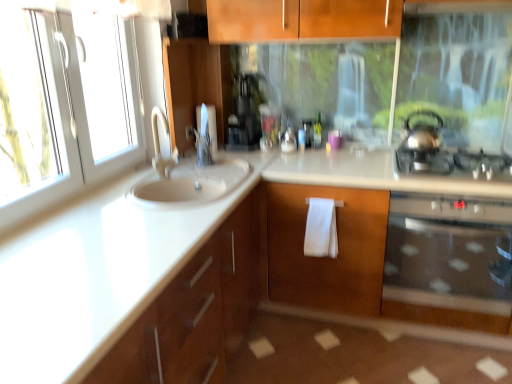
Question: Can you confirm if white cotton bath towel at center is wider than white glossy toilet paper at upper center?

Choices:
 (A) no
 (B) yes

Answer: (A)

Question: Is white cotton bath towel at center at the left side of white glossy toilet paper at upper center?

Choices:
 (A) yes
 (B) no

Answer: (B)

Question: Is white cotton bath towel at center to the right of white glossy toilet paper at upper center from the viewer's perspective?

Choices:
 (A) no
 (B) yes

Answer: (B)

Question: From a real-world perspective, is white cotton bath towel at center on top of white glossy toilet paper at upper center?

Choices:
 (A) yes
 (B) no

Answer: (B)

Question: Is white cotton bath towel at center positioned in front of white glossy toilet paper at upper center?

Choices:
 (A) yes
 (B) no

Answer: (A)

Question: Would you say white cotton bath towel at center is to the left or to the right of satin silver gas stove at right in the picture?

Choices:
 (A) right
 (B) left

Answer: (B)

Question: Is white cotton bath towel at center wider or thinner than satin silver gas stove at right?

Choices:
 (A) thin
 (B) wide

Answer: (A)

Question: Considering their positions, is white cotton bath towel at center located in front of or behind satin silver gas stove at right?

Choices:
 (A) behind
 (B) front

Answer: (A)

Question: Would you say white cotton bath towel at center is inside or outside satin silver gas stove at right?

Choices:
 (A) outside
 (B) inside

Answer: (A)

Question: Is point (428, 114) closer or farther from the camera than point (197, 127)?

Choices:
 (A) closer
 (B) farther

Answer: (A)

Question: Looking at the image, does shiny metallic kettle at right seem bigger or smaller compared to white glossy toilet paper at upper center?

Choices:
 (A) big
 (B) small

Answer: (A)

Question: Considering the positions of shiny metallic kettle at right and white glossy toilet paper at upper center in the image, is shiny metallic kettle at right wider or thinner than white glossy toilet paper at upper center?

Choices:
 (A) wide
 (B) thin

Answer: (A)

Question: Is shiny metallic kettle at right taller or shorter than white glossy toilet paper at upper center?

Choices:
 (A) tall
 (B) short

Answer: (B)

Question: From a real-world perspective, is stainless steel oven at right above or below white glossy sink at left?

Choices:
 (A) above
 (B) below

Answer: (A)

Question: Considering the positions of point (389, 233) and point (31, 345), is point (389, 233) closer or farther from the camera than point (31, 345)?

Choices:
 (A) farther
 (B) closer

Answer: (A)